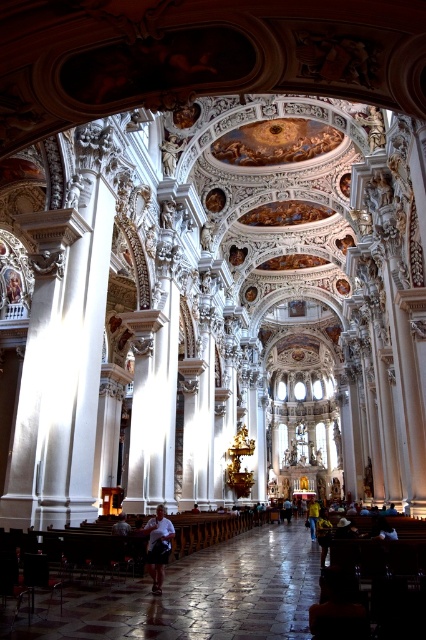
You are standing in the center of the church and see a yellow shirt at center and a light brown leather jacket at center. Which one is closer to you?

Both the yellow shirt at center and the light brown leather jacket at center are at the same distance from you since they are both located at the center of the church.

You are standing at the entrance of the cathedral and see two people wearing a white matte shirt at center and a yellow shirt at center. Which person is standing closer to you?

The white matte shirt at center is closer to the viewer than the yellow shirt at center, so the person wearing the white matte shirt at center is closer to you.